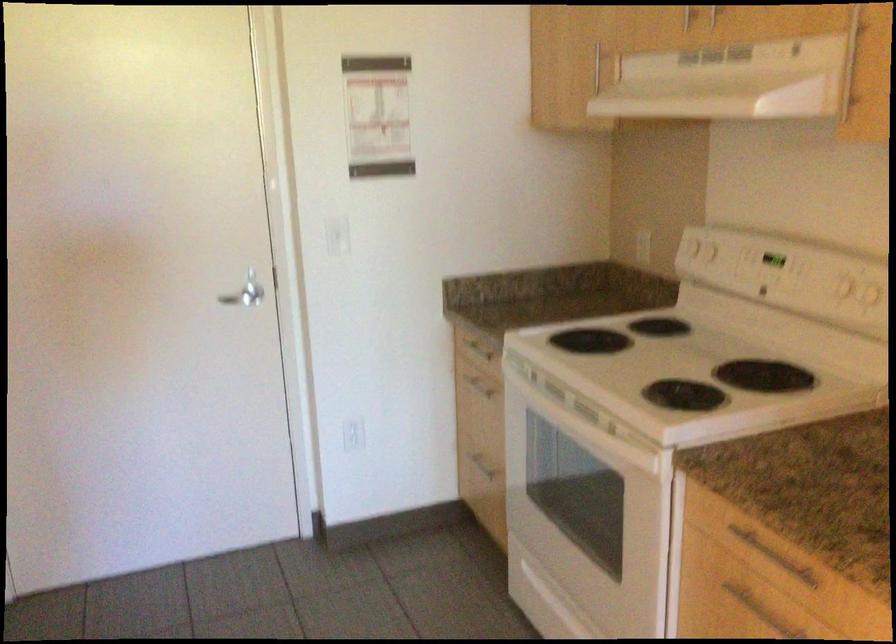
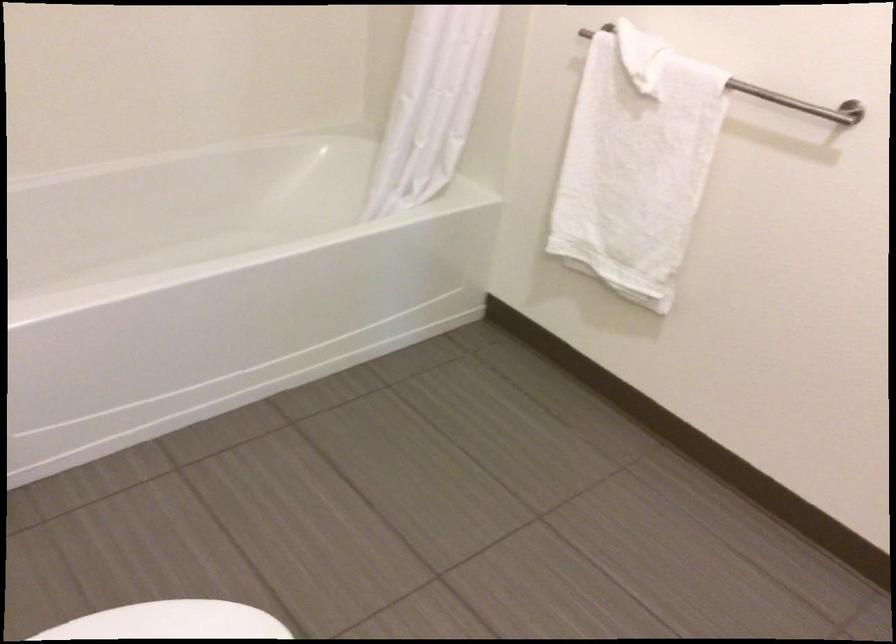
Question: I am providing you with two images of the same scene from different viewpoints. After the viewpoint changes to image2, which objects are now occluded?

Choices:
 (A) white toilet lid
 (B) drawer handle
 (C) black stapler top
 (D) white towel

Answer: (B)